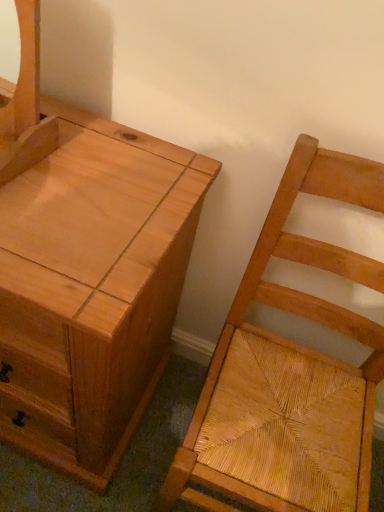
Question: From a real-world perspective, is natural wood chest of drawers at left above or below natural wood woven seat at right?

Choices:
 (A) above
 (B) below

Answer: (B)

Question: Is point (39, 101) positioned closer to the camera than point (294, 305)?

Choices:
 (A) farther
 (B) closer

Answer: (B)

Question: From the image's perspective, is natural wood chest of drawers at left positioned above or below natural wood woven seat at right?

Choices:
 (A) above
 (B) below

Answer: (A)

Question: Is natural wood woven seat at right situated inside natural wood chest of drawers at left or outside?

Choices:
 (A) outside
 (B) inside

Answer: (A)

Question: Is natural wood woven seat at right to the left or to the right of natural wood chest of drawers at left in the image?

Choices:
 (A) right
 (B) left

Answer: (A)

Question: Based on their sizes in the image, would you say natural wood woven seat at right is bigger or smaller than natural wood chest of drawers at left?

Choices:
 (A) big
 (B) small

Answer: (B)

Question: Is natural wood woven seat at right taller or shorter than natural wood chest of drawers at left?

Choices:
 (A) short
 (B) tall

Answer: (B)